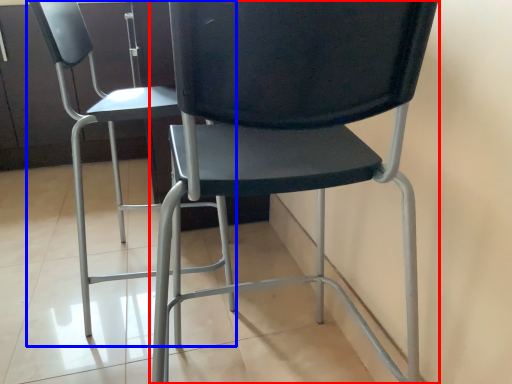
Question: Which point is closer to the camera, chair (highlighted by a red box) or chair (highlighted by a blue box)?

Choices:
 (A) chair
 (B) chair

Answer: (A)